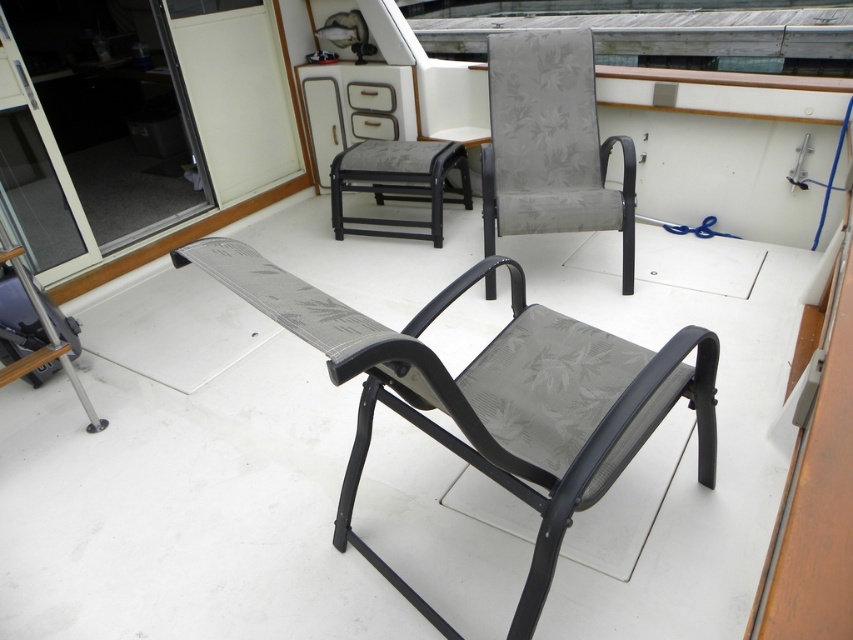
Does textured grey fabric chair at center appear over transparent glass door at upper left?

Incorrect, textured grey fabric chair at center is not positioned above transparent glass door at upper left.

Is point (343, 336) farther from camera compared to point (20, 54)?

No, it is in front of (20, 54).

Does point (477, 397) lie in front of point (160, 109)?

Yes, it is.

Find the location of a particular element. The width and height of the screenshot is (853, 640). textured grey fabric chair at center is located at coordinates (491, 397).

Between textured grey fabric chair at center and gray fabric stool at center, which one appears on the right side from the viewer's perspective?

textured grey fabric chair at center is more to the right.

How distant is textured grey fabric chair at center from gray fabric stool at center?

textured grey fabric chair at center is 5.83 feet from gray fabric stool at center.

Which is behind, point (554, 353) or point (352, 168)?

The point (352, 168) is behind.

The width and height of the screenshot is (853, 640). I want to click on textured grey fabric chair at center, so click(491, 397).

Which is in front, point (567, 108) or point (431, 164)?

Point (567, 108) is in front.

Is gray fabric chair at upper center taller than gray fabric stool at center?

Correct, gray fabric chair at upper center is much taller as gray fabric stool at center.

Is point (631, 243) closer to camera compared to point (462, 184)?

Yes, it is in front of point (462, 184).

The image size is (853, 640). What are the coordinates of `gray fabric chair at upper center` in the screenshot? It's located at (550, 145).